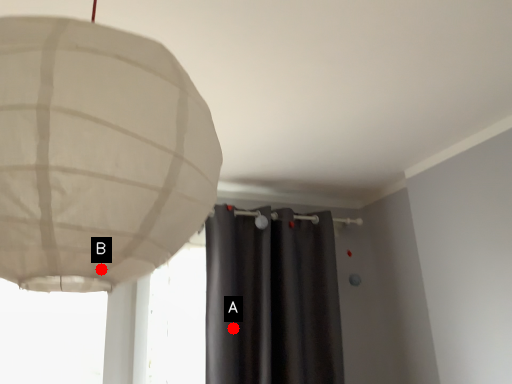
Question: Two points are circled on the image, labeled by A and B beside each circle. Which point is closer to the camera?

Choices:
 (A) A is closer
 (B) B is closer

Answer: (B)